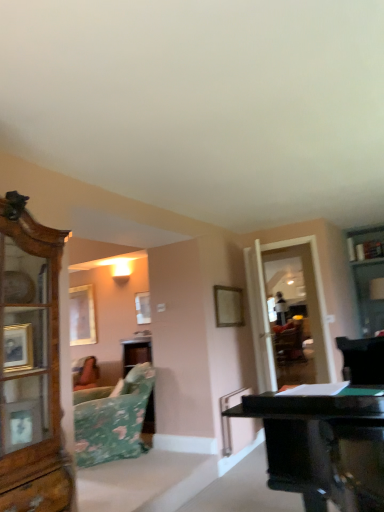
Measure the distance between floral fabric couch at lower left and camera.

floral fabric couch at lower left is 12.24 feet from camera.

What do you see at coordinates (112, 419) in the screenshot? I see `floral fabric couch at lower left` at bounding box center [112, 419].

In order to face wooden picture frame at center, marked as the 2th picture frame in a back-to-front arrangement, should I rotate leftwards or rightwards?

Turn right by 5.330 degrees to look at wooden picture frame at center, marked as the 2th picture frame in a back-to-front arrangement.

In order to click on floral fabric couch at lower left in this screenshot , I will do pyautogui.click(x=112, y=419).

Is floral fabric couch at lower left oriented towards wooden picture frame at center, placed as the 2th picture frame when sorted from left to right?

No, floral fabric couch at lower left is not facing towards wooden picture frame at center, placed as the 2th picture frame when sorted from left to right.

Considering the relative sizes of floral fabric couch at lower left and wooden picture frame at center, marked as the 2th picture frame in a back-to-front arrangement, in the image provided, is floral fabric couch at lower left wider than wooden picture frame at center, marked as the 2th picture frame in a back-to-front arrangement,?

Indeed, floral fabric couch at lower left has a greater width compared to wooden picture frame at center, marked as the 2th picture frame in a back-to-front arrangement.

Identify the location of the 1st picture frame above the floral fabric couch at lower left (from a real-world perspective). (228, 306).

Is floral fabric couch at lower left taller than wooden picture frame at center, marked as the 2th picture frame in a back-to-front arrangement?

Correct, floral fabric couch at lower left is much taller as wooden picture frame at center, marked as the 2th picture frame in a back-to-front arrangement.

Is wooden picture frame at center, which appears as the 1th picture frame when viewed from the right, in contact with floral fabric couch at lower left?

No, wooden picture frame at center, which appears as the 1th picture frame when viewed from the right, is not touching floral fabric couch at lower left.

From a real-world perspective, which object rests below the other?

floral fabric couch at lower left, from a real-world perspective.

Is point (234, 318) closer to viewer compared to point (107, 434)?

No, it is behind (107, 434).

Considering the relative sizes of wooden picture frame at center, which appears as the 1th picture frame when viewed from the right, and floral fabric couch at lower left in the image provided, is wooden picture frame at center, which appears as the 1th picture frame when viewed from the right, bigger than floral fabric couch at lower left?

No, wooden picture frame at center, which appears as the 1th picture frame when viewed from the right, is not bigger than floral fabric couch at lower left.

Is the position of transparent glass door at right more distant than that of wooden picture frame at center, marked as the 2th picture frame in a back-to-front arrangement?

Yes, transparent glass door at right is behind wooden picture frame at center, marked as the 2th picture frame in a back-to-front arrangement.

Does transparent glass door at right have a smaller size compared to wooden picture frame at center, marked as the 2th picture frame in a back-to-front arrangement?

No.

From the picture: Does transparent glass door at right touch wooden picture frame at center, placed as the 2th picture frame when sorted from left to right?

No, transparent glass door at right is not next to wooden picture frame at center, placed as the 2th picture frame when sorted from left to right.

From a real-world perspective, is transparent glass door at right below wooden picture frame at center, which appears as the 1th picture frame when viewed from the right?

Indeed, from a real-world perspective, transparent glass door at right is positioned beneath wooden picture frame at center, which appears as the 1th picture frame when viewed from the right.

Between transparent glass door at right and wooden picture frame at upper left, the 2th picture frame positioned from the front, which one has larger size?

transparent glass door at right is bigger.

Does transparent glass door at right turn towards wooden picture frame at upper left, arranged as the 2th picture frame when viewed from the right?

No, transparent glass door at right does not turn towards wooden picture frame at upper left, arranged as the 2th picture frame when viewed from the right.

From the image's perspective, between transparent glass door at right and wooden picture frame at upper left, the 1th picture frame when ordered from back to front, which one is located above?

transparent glass door at right is shown above in the image.

From a real-world perspective, which is physically below, transparent glass door at right or wooden picture frame at upper left, which is the first picture frame from left to right?

transparent glass door at right.

How different are the orientations of wooden picture frame at upper left, the 1th picture frame when ordered from back to front, and floral fabric couch at lower left in degrees?

33.9 degrees.

Are wooden picture frame at upper left, arranged as the 2th picture frame when viewed from the right, and floral fabric couch at lower left beside each other?

No, wooden picture frame at upper left, arranged as the 2th picture frame when viewed from the right, is not next to floral fabric couch at lower left.

Which is in front, point (87, 286) or point (115, 450)?

Positioned in front is point (115, 450).

From the image's perspective, is wooden picture frame at upper left, which is the first picture frame from left to right, over floral fabric couch at lower left?

Yes, from the image's perspective, wooden picture frame at upper left, which is the first picture frame from left to right, is above floral fabric couch at lower left.

In terms of height, does wooden picture frame at center, placed as the 2th picture frame when sorted from left to right, look taller or shorter compared to wooden picture frame at upper left, which is the first picture frame from left to right?

In the image, wooden picture frame at center, placed as the 2th picture frame when sorted from left to right, appears to be shorter than wooden picture frame at upper left, which is the first picture frame from left to right.

From a real-world perspective, is wooden picture frame at center, which appears as the 1th picture frame when viewed from the right, located beneath wooden picture frame at upper left, which is the first picture frame from left to right?

Yes.

From the image's perspective, between wooden picture frame at center, marked as the 2th picture frame in a back-to-front arrangement, and wooden picture frame at upper left, the 2th picture frame positioned from the front, who is located below?

wooden picture frame at upper left, the 2th picture frame positioned from the front.

Is wooden picture frame at center, placed as the 2th picture frame when sorted from left to right, directly adjacent to wooden picture frame at upper left, which is the first picture frame from left to right?

No, wooden picture frame at center, placed as the 2th picture frame when sorted from left to right, is not touching wooden picture frame at upper left, which is the first picture frame from left to right.

Is point (89, 416) more distant than point (317, 300)?

No, (89, 416) is in front of (317, 300).

Based on the photo, which is more to the left, floral fabric couch at lower left or transparent glass door at right?

Positioned to the left is floral fabric couch at lower left.

Can you confirm if floral fabric couch at lower left is shorter than transparent glass door at right?

Yes.

Where is `studio couch on the left of the wooden picture frame at center, marked as the 2th picture frame in a back-to-front arrangement`? studio couch on the left of the wooden picture frame at center, marked as the 2th picture frame in a back-to-front arrangement is located at coordinates (112, 419).

Find the location of `the 1st picture frame directly above the floral fabric couch at lower left (from a real-world perspective)`. the 1st picture frame directly above the floral fabric couch at lower left (from a real-world perspective) is located at coordinates (228, 306).

Based on their spatial positions, is wooden picture frame at center, placed as the 2th picture frame when sorted from left to right, or floral fabric couch at lower left closer to wooden picture frame at upper left, arranged as the 2th picture frame when viewed from the right?

The object closer to wooden picture frame at upper left, arranged as the 2th picture frame when viewed from the right, is floral fabric couch at lower left.

Considering their positions, is wooden picture frame at upper left, which is the first picture frame from left to right, positioned closer to wooden picture frame at center, marked as the 2th picture frame in a back-to-front arrangement, than floral fabric couch at lower left?

Based on the image, floral fabric couch at lower left appears to be nearer to wooden picture frame at center, marked as the 2th picture frame in a back-to-front arrangement.

Estimate the real-world distances between objects in this image. Which object is closer to transparent glass door at right, wooden picture frame at center, placed as the 2th picture frame when sorted from left to right, or floral fabric couch at lower left?

Based on the image, wooden picture frame at center, placed as the 2th picture frame when sorted from left to right, appears to be nearer to transparent glass door at right.

When comparing their distances from floral fabric couch at lower left, does wooden picture frame at upper left, which is the first picture frame from left to right, or wooden picture frame at center, placed as the 2th picture frame when sorted from left to right, seem further?

Among the two, wooden picture frame at upper left, which is the first picture frame from left to right, is located further to floral fabric couch at lower left.

From the picture: Estimate the real-world distances between objects in this image. Which object is closer to floral fabric couch at lower left, wooden picture frame at center, marked as the 2th picture frame in a back-to-front arrangement, or wooden picture frame at upper left, the 2th picture frame positioned from the front?

wooden picture frame at center, marked as the 2th picture frame in a back-to-front arrangement, is positioned closer to the anchor floral fabric couch at lower left.

Estimate the real-world distances between objects in this image. Which object is further from transparent glass door at right, wooden picture frame at upper left, the 1th picture frame when ordered from back to front, or floral fabric couch at lower left?

wooden picture frame at upper left, the 1th picture frame when ordered from back to front, is further to transparent glass door at right.

Estimate the real-world distances between objects in this image. Which object is further from floral fabric couch at lower left, wooden picture frame at center, which appears as the 1th picture frame when viewed from the right, or transparent glass door at right?

Among the two, transparent glass door at right is located further to floral fabric couch at lower left.

Considering their positions, is wooden picture frame at center, which appears as the 1th picture frame when viewed from the right, positioned further to wooden picture frame at upper left, the 2th picture frame positioned from the front, than transparent glass door at right?

transparent glass door at right.

Locate an element on the screen. studio couch between wooden picture frame at upper left, the 2th picture frame positioned from the front, and transparent glass door at right is located at coordinates (112, 419).

Where is `picture frame located between wooden picture frame at upper left, arranged as the 2th picture frame when viewed from the right, and transparent glass door at right in the left-right direction`? The width and height of the screenshot is (384, 512). picture frame located between wooden picture frame at upper left, arranged as the 2th picture frame when viewed from the right, and transparent glass door at right in the left-right direction is located at coordinates (228, 306).

At what (x,y) coordinates should I click in order to perform the action: click on picture frame between floral fabric couch at lower left and transparent glass door at right in the horizontal direction. Please return your answer as a coordinate pair (x, y). The height and width of the screenshot is (512, 384). Looking at the image, I should click on (228, 306).

Find the location of `picture frame positioned between floral fabric couch at lower left and wooden picture frame at upper left, arranged as the 2th picture frame when viewed from the right, from near to far`. picture frame positioned between floral fabric couch at lower left and wooden picture frame at upper left, arranged as the 2th picture frame when viewed from the right, from near to far is located at coordinates (228, 306).